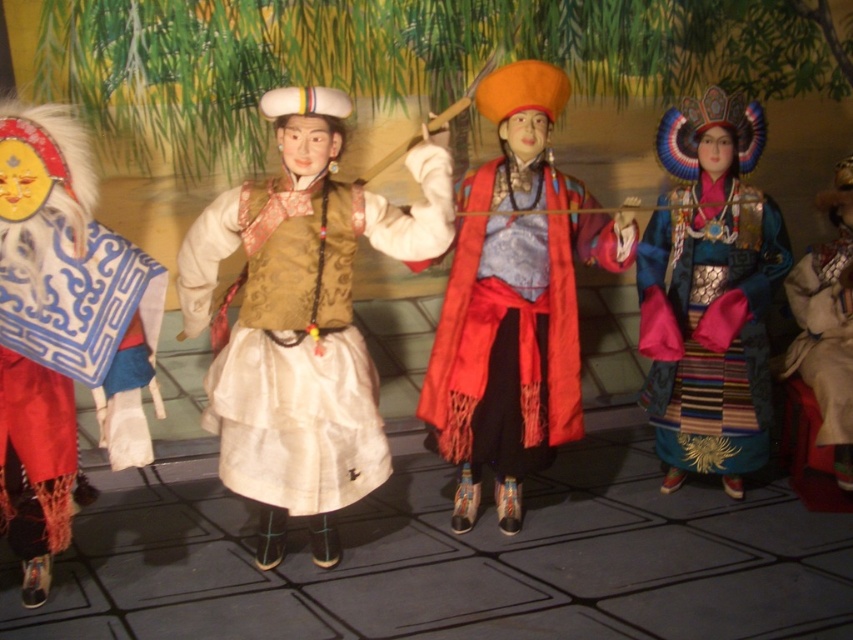
Question: Is satin beige vest at center below silky blue dress at right?

Choices:
 (A) no
 (B) yes

Answer: (B)

Question: Considering the relative positions of matte blue fabric mask at left and shiny blue silk dress at center in the image provided, where is matte blue fabric mask at left located with respect to shiny blue silk dress at center?

Choices:
 (A) above
 (B) below

Answer: (B)

Question: Which point is farther to the camera?

Choices:
 (A) (42, 490)
 (B) (764, 349)
 (C) (508, 218)
 (D) (842, 342)

Answer: (D)

Question: Is matte blue fabric mask at left wider than shiny blue silk dress at center?

Choices:
 (A) yes
 (B) no

Answer: (B)

Question: Among these objects, which one is nearest to the camera?

Choices:
 (A) satin beige vest at center
 (B) silky red robe at center

Answer: (A)

Question: Which point is farther to the camera?

Choices:
 (A) (144, 461)
 (B) (720, 262)
 (C) (819, 252)

Answer: (C)